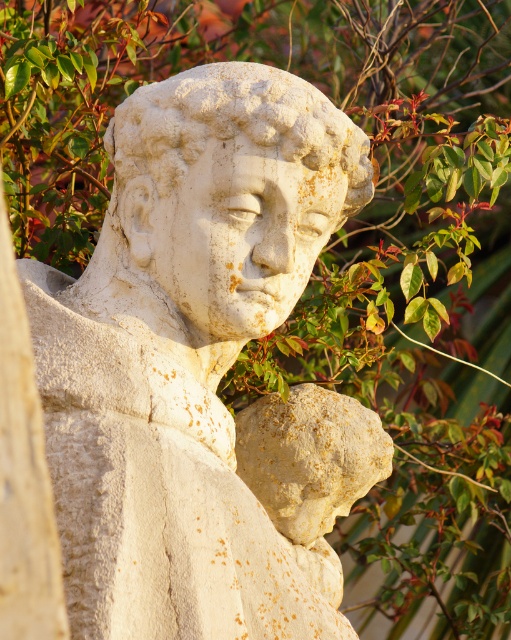
Between point (117, 369) and point (264, 481), which one is positioned behind?

The point (264, 481) is more distant.

Does point (227, 568) come behind point (252, 483)?

No, (227, 568) is in front of (252, 483).

Is point (211, 611) less distant than point (327, 531)?

That is True.

Find the location of `white stone statue at center`. white stone statue at center is located at coordinates (187, 355).

Is white stone statue at center to the left of white stone head at center from the viewer's perspective?

Indeed, white stone statue at center is positioned on the left side of white stone head at center.

Where is `white stone statue at center`? The width and height of the screenshot is (511, 640). white stone statue at center is located at coordinates (187, 355).

Is white stone head at center positioned in front of speckled stone head at center?

That is True.

Who is more distant from viewer, [206,100] or [313,538]?

The point [313,538] is behind.

Locate an element on the screen. Image resolution: width=511 pixels, height=640 pixels. white stone head at center is located at coordinates (234, 125).